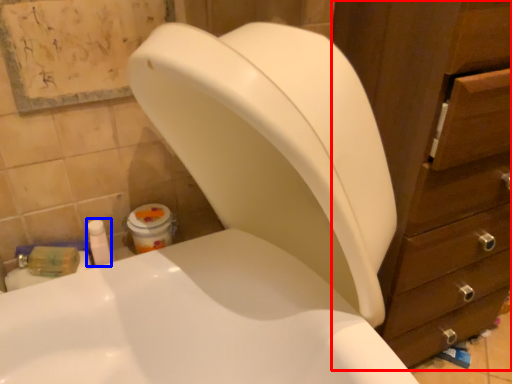
Question: Which of the following is the closest to the observer, cabinet (highlighted by a red box) or toiletry (highlighted by a blue box)?

Choices:
 (A) cabinet
 (B) toiletry

Answer: (A)